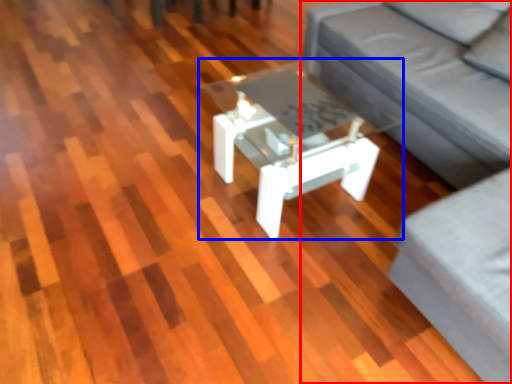
Question: Which object appears farthest to the camera in this image, studio couch (highlighted by a red box) or coffee table (highlighted by a blue box)?

Choices:
 (A) studio couch
 (B) coffee table

Answer: (B)